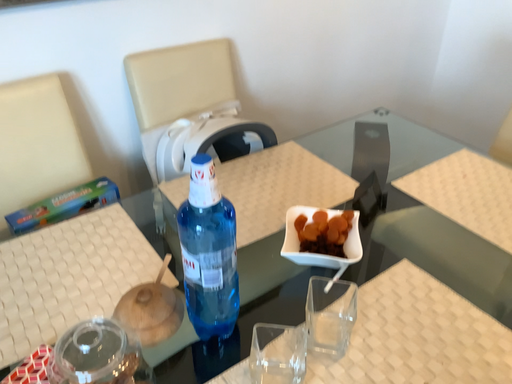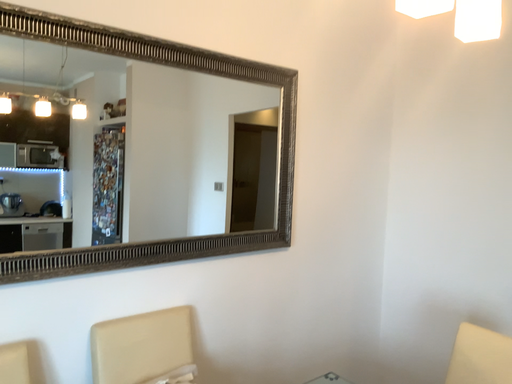
Question: How did the camera likely rotate when shooting the video?

Choices:
 (A) rotated upward
 (B) rotated downward

Answer: (A)